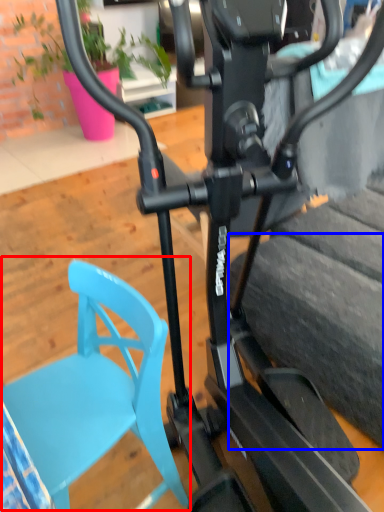
Question: Which object is closer to the camera taking this photo, swivel chair (highlighted by a red box) or tire (highlighted by a blue box)?

Choices:
 (A) swivel chair
 (B) tire

Answer: (A)